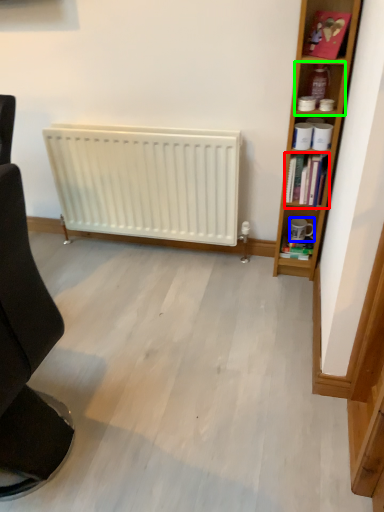
Question: Considering the real-world distances, which object is farthest from book (highlighted by a red box)? coffee cup (highlighted by a blue box) or shelf (highlighted by a green box)?

Choices:
 (A) coffee cup
 (B) shelf

Answer: (A)